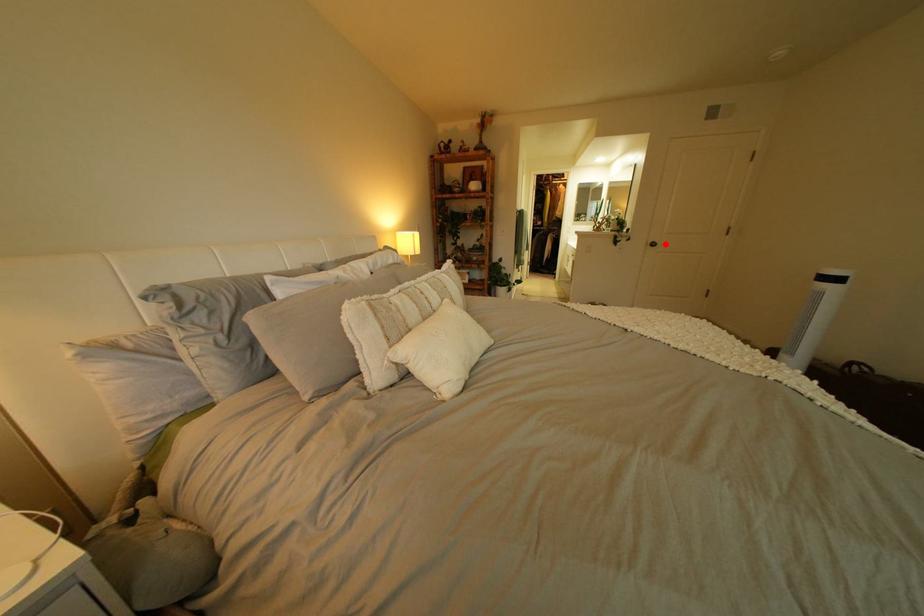
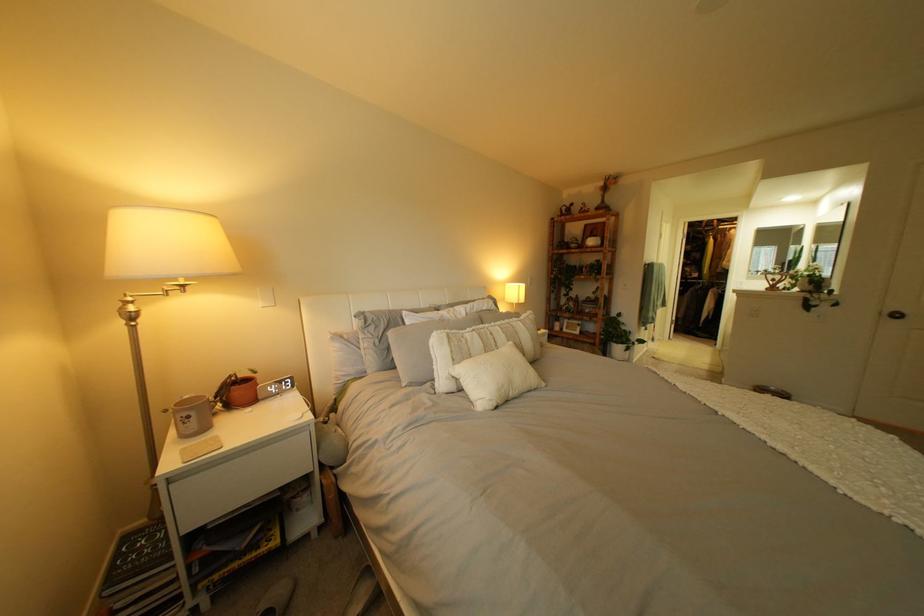
Locate, in the second image, the point that corresponds to the highlighted location in the first image.

(903, 313)